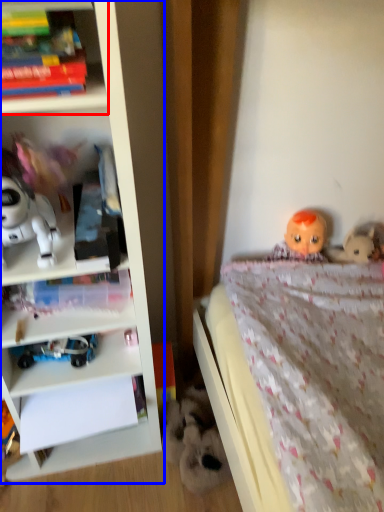
Question: Among these objects, which one is farthest to the camera, shelf (highlighted by a red box) or bookcase (highlighted by a blue box)?

Choices:
 (A) shelf
 (B) bookcase

Answer: (A)